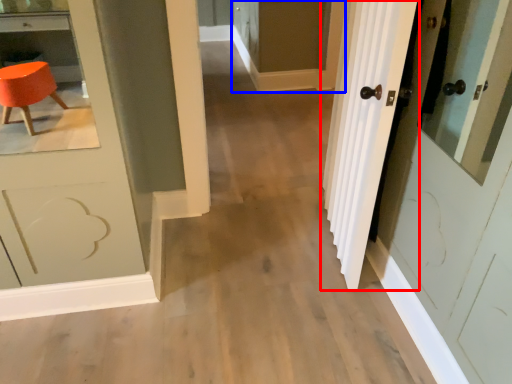
Question: Which object is closer to the camera taking this photo, door (highlighted by a red box) or screen door (highlighted by a blue box)?

Choices:
 (A) door
 (B) screen door

Answer: (A)